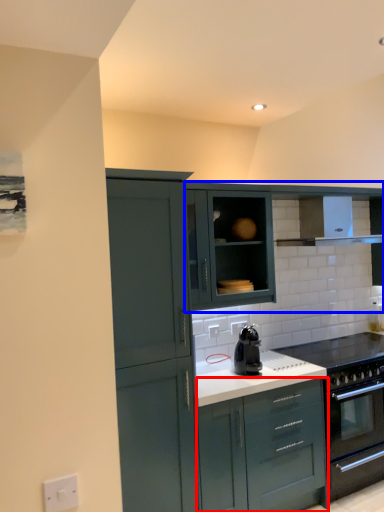
Question: Which point is further to the camera, cabinetry (highlighted by a red box) or cabinetry (highlighted by a blue box)?

Choices:
 (A) cabinetry
 (B) cabinetry

Answer: (B)